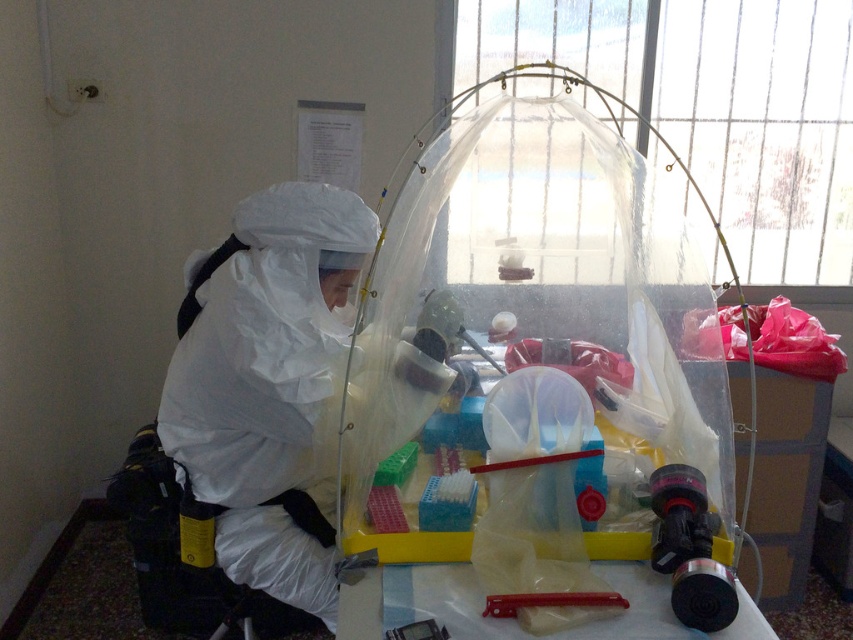
Question: Which point is closer to the camera?

Choices:
 (A) white matte/soft hazmat suit at center
 (B) translucent plastic equipment at center

Answer: (B)

Question: Is translucent plastic equipment at center bigger than white matte/soft hazmat suit at center?

Choices:
 (A) no
 (B) yes

Answer: (B)

Question: Does translucent plastic equipment at center appear on the right side of white matte/soft hazmat suit at center?

Choices:
 (A) yes
 (B) no

Answer: (A)

Question: Can you confirm if translucent plastic equipment at center is bigger than white matte/soft hazmat suit at center?

Choices:
 (A) no
 (B) yes

Answer: (B)

Question: Which point is closer to the camera taking this photo?

Choices:
 (A) (720, 436)
 (B) (212, 298)

Answer: (B)